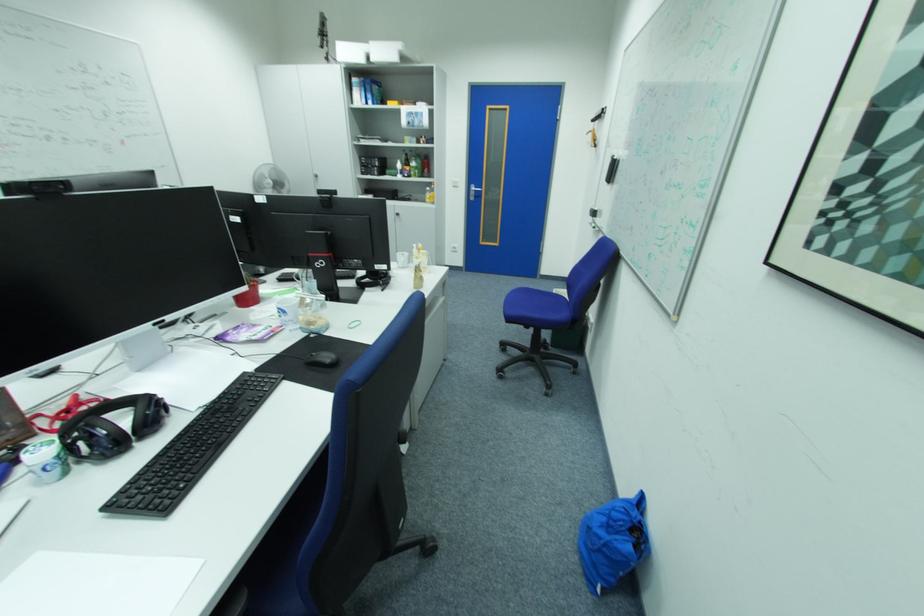
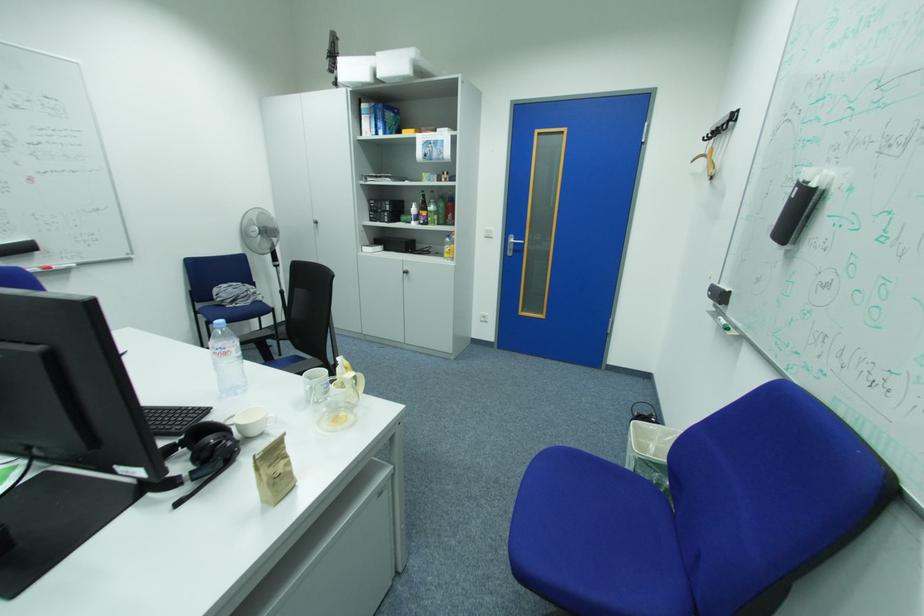
Find the pixel in the second image that matches (x=481, y=188) in the first image.

(520, 240)